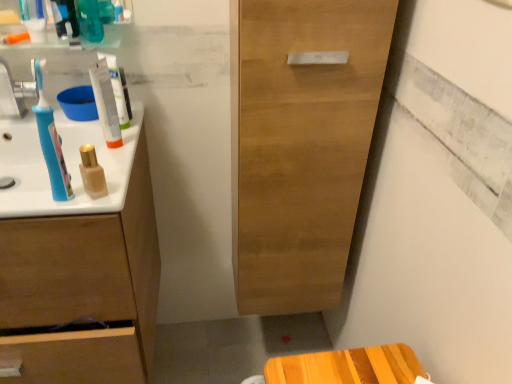
I want to click on white glossy tube at upper center, so click(x=117, y=90).

Identify the location of light brown wood cabinet at center. This screenshot has width=512, height=384. (302, 145).

Locate an element on the screen. Image resolution: width=512 pixels, height=384 pixels. blue plastic toothbrush at left is located at coordinates (14, 93).

What do you see at coordinates (92, 173) in the screenshot?
I see `matte beige bottle at center, the first mouthwash from the bottom` at bounding box center [92, 173].

What do you see at coordinates (51, 143) in the screenshot?
I see `blue plastic toothbrush at left` at bounding box center [51, 143].

At what (x,y) coordinates should I click in order to perform the action: click on white glossy sink at left. Please return your answer as a coordinate pair (x, y). The width and height of the screenshot is (512, 384). Looking at the image, I should click on (66, 165).

From the image's perspective, is matte brown cabinet at left over white glossy sink at left?

No.

Can you confirm if matte brown cabinet at left is positioned to the left of white glossy sink at left?

Correct, you'll find matte brown cabinet at left to the left of white glossy sink at left.

Between matte brown cabinet at left and white glossy sink at left, which one has smaller size?

Smaller between the two is white glossy sink at left.

Who is taller, matte brown cabinet at left or white glossy sink at left?

matte brown cabinet at left.

Starting from the matte brown cabinet at left, which mouthwash is the 2nd one to the right? Please provide its 2D coordinates.

[(92, 173)]

From the image's perspective, which object appears higher, matte brown cabinet at left or matte beige bottle at center, the second mouthwash positioned from the left?

matte beige bottle at center, the second mouthwash positioned from the left, appears higher in the image.

Would you say matte brown cabinet at left is inside or outside matte beige bottle at center, the first mouthwash from the bottom?

matte brown cabinet at left lies outside matte beige bottle at center, the first mouthwash from the bottom.

Relative to matte beige bottle at center, the 1th mouthwash viewed from the front, is matte brown cabinet at left in front or behind?

matte brown cabinet at left is in front of matte beige bottle at center, the 1th mouthwash viewed from the front.

From a real-world perspective, which object rests below the other?

white glossy tube at upper center is physically lower.

Is teal glossy mouthwash at upper left, which is counted as the first mouthwash, starting from the left, not near white glossy tube at upper center?

teal glossy mouthwash at upper left, which is counted as the first mouthwash, starting from the left, is near white glossy tube at upper center, not far away.

How much distance is there between teal glossy mouthwash at upper left, which is the 2th mouthwash from right to left, and white glossy tube at upper center?

They are 6.00 inches apart.

Is teal glossy mouthwash at upper left, which is the 2th mouthwash from right to left, facing towards white glossy tube at upper center?

Answer: No, teal glossy mouthwash at upper left, which is the 2th mouthwash from right to left, does not turn towards white glossy tube at upper center.

Is white glossy sink at left smaller than matte brown cabinet at left?

Yes.

You are a GUI agent. You are given a task and a screenshot of the screen. Output one action in this format:
    pyautogui.click(x=<x>, y=<y>)
    Task: Click on the bathroom cabinet below the white glossy sink at left (from the image's perspective)
    The image size is (512, 384).
    Given the screenshot: What is the action you would take?
    pyautogui.click(x=80, y=238)

Is white glossy sink at left oriented away from matte brown cabinet at left?

That's right, white glossy sink at left is facing away from matte brown cabinet at left.

From a real-world perspective, is white glossy sink at left located higher than matte brown cabinet at left?

Yes, from a real-world perspective, white glossy sink at left is above matte brown cabinet at left.

Which object is further away from the camera, blue plastic toothbrush at left or light brown wood cabinet at center?

blue plastic toothbrush at left is further from the camera.

Is blue plastic toothbrush at left thinner than light brown wood cabinet at center?

Correct, the width of blue plastic toothbrush at left is less than that of light brown wood cabinet at center.

From a real-world perspective, is blue plastic toothbrush at left under light brown wood cabinet at center?

Incorrect, from a real-world perspective, blue plastic toothbrush at left is higher than light brown wood cabinet at center.

Is blue plastic toothbrush at left positioned with its back to light brown wood cabinet at center?

No.

How many degrees apart are the facing directions of white glossy sink at left and white glossy tube at upper center?

0.459 degrees separate the facing orientations of white glossy sink at left and white glossy tube at upper center.

Based on the photo, considering the relative sizes of white glossy sink at left and white glossy tube at upper center in the image provided, is white glossy sink at left thinner than white glossy tube at upper center?

Incorrect, the width of white glossy sink at left is not less than that of white glossy tube at upper center.

Looking at this image, considering the sizes of white glossy sink at left and white glossy tube at upper center in the image, is white glossy sink at left bigger or smaller than white glossy tube at upper center?

In the image, white glossy sink at left appears to be larger than white glossy tube at upper center.

Is white glossy sink at left beside white glossy tube at upper center?

white glossy sink at left and white glossy tube at upper center are not in contact.

Can you confirm if white glossy tube at upper center is taller than teal glossy mouthwash at upper left, the first mouthwash positioned from the back?

No, white glossy tube at upper center is not taller than teal glossy mouthwash at upper left, the first mouthwash positioned from the back.

Measure the distance from white glossy tube at upper center to teal glossy mouthwash at upper left, which is the 2th mouthwash from right to left.

The distance of white glossy tube at upper center from teal glossy mouthwash at upper left, which is the 2th mouthwash from right to left, is 6.00 inches.

Does white glossy tube at upper center appear on the right side of teal glossy mouthwash at upper left, the first mouthwash when ordered from top to bottom?

Correct, you'll find white glossy tube at upper center to the right of teal glossy mouthwash at upper left, the first mouthwash when ordered from top to bottom.

Consider the image. Which is correct: white glossy tube at upper center is inside teal glossy mouthwash at upper left, the 2th mouthwash positioned from the front, or outside of it?

white glossy tube at upper center is not enclosed by teal glossy mouthwash at upper left, the 2th mouthwash positioned from the front.

Image resolution: width=512 pixels, height=384 pixels. Find the location of `sink behind the matte brown cabinet at left`. sink behind the matte brown cabinet at left is located at coordinates (66, 165).

The height and width of the screenshot is (384, 512). I want to click on bathroom cabinet to the left of matte beige bottle at center, the first mouthwash from the bottom, so [80, 238].

Looking at the image, which one is located closer to blue plastic toothbrush at left, light brown wood cabinet at center or teal glossy mouthwash at upper left, which is the 2th mouthwash from right to left?

teal glossy mouthwash at upper left, which is the 2th mouthwash from right to left, is positioned closer to the anchor blue plastic toothbrush at left.

From the image, which object appears to be nearer to matte beige bottle at center, which appears as the 1th mouthwash when viewed from the right, white glossy sink at left or matte brown cabinet at left?

white glossy sink at left.

Based on their spatial positions, is light brown wood cabinet at center or matte beige bottle at center, which appears as the 1th mouthwash when viewed from the right, closer to blue plastic toothbrush at left?

matte beige bottle at center, which appears as the 1th mouthwash when viewed from the right, lies closer to blue plastic toothbrush at left than the other object.

Looking at the image, which one is located further to teal glossy mouthwash at upper left, which is counted as the first mouthwash, starting from the left, white glossy sink at left or blue plastic toothbrush at left?

blue plastic toothbrush at left lies further to teal glossy mouthwash at upper left, which is counted as the first mouthwash, starting from the left, than the other object.

Looking at the image, which one is located further to light brown wood cabinet at center, blue plastic toothbrush at left or blue plastic toothbrush at left?

The object further to light brown wood cabinet at center is blue plastic toothbrush at left.

When comparing their distances from white glossy sink at left, does teal glossy mouthwash at upper left, the first mouthwash positioned from the back, or blue plastic toothbrush at left seem further?

teal glossy mouthwash at upper left, the first mouthwash positioned from the back, is further to white glossy sink at left.

When comparing their distances from teal glossy mouthwash at upper left, the 2th mouthwash positioned from the front, does white glossy tube at upper center or blue plastic toothbrush at left seem further?

blue plastic toothbrush at left.

Based on their spatial positions, is white glossy sink at left or blue plastic toothbrush at left further from light brown wood cabinet at center?

blue plastic toothbrush at left.

You are a GUI agent. You are given a task and a screenshot of the screen. Output one action in this format:
    pyautogui.click(x=<x>, y=<y>)
    Task: Click on the sink that lies between teal glossy mouthwash at upper left, the 2th mouthwash from the bottom, and matte brown cabinet at left from top to bottom
    This screenshot has width=512, height=384.
    Given the screenshot: What is the action you would take?
    pyautogui.click(x=66, y=165)

This screenshot has width=512, height=384. What are the coordinates of `toothbrush between matte brown cabinet at left and light brown wood cabinet at center` in the screenshot? It's located at (51, 143).

This screenshot has height=384, width=512. Identify the location of toothpaste situated between white glossy sink at left and light brown wood cabinet at center from left to right. (117, 90).

Find the location of a particular element. The height and width of the screenshot is (384, 512). sink between matte brown cabinet at left and light brown wood cabinet at center is located at coordinates (66, 165).